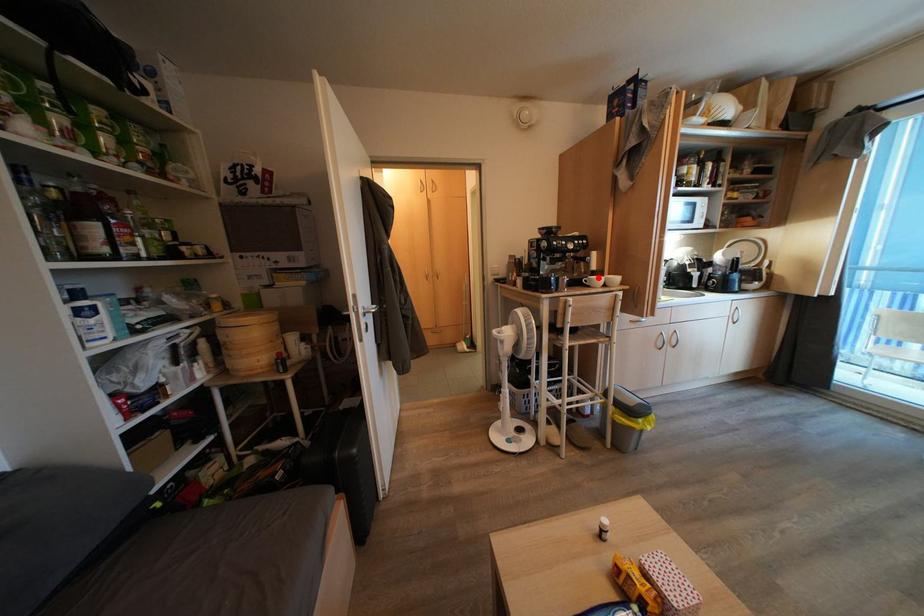
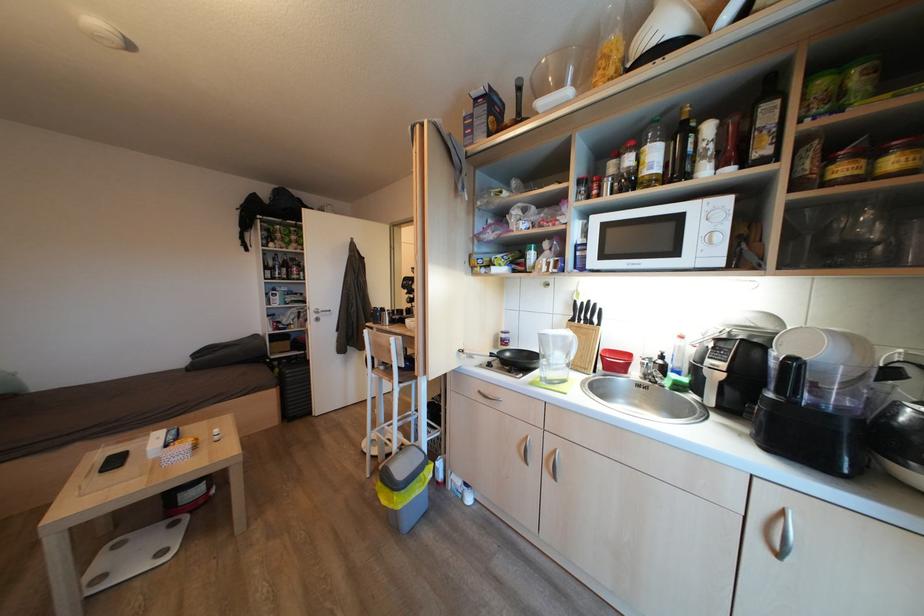
Question: I am providing you with two images of the same scene from different viewpoints. A red point is marked on the first image. Can you still see the location of the red point in image 2?

Choices:
 (A) Yes
 (B) No

Answer: (B)